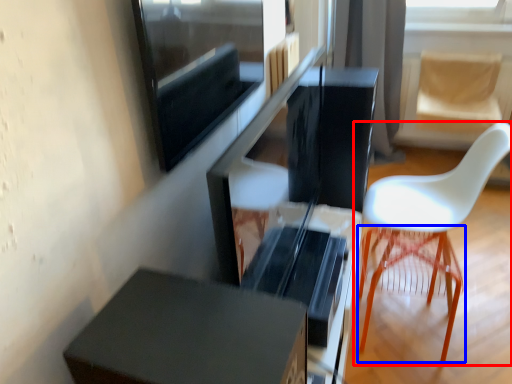
Question: Which object is closer to the camera taking this photo, chair (highlighted by a red box) or bar stool (highlighted by a blue box)?

Choices:
 (A) chair
 (B) bar stool

Answer: (A)